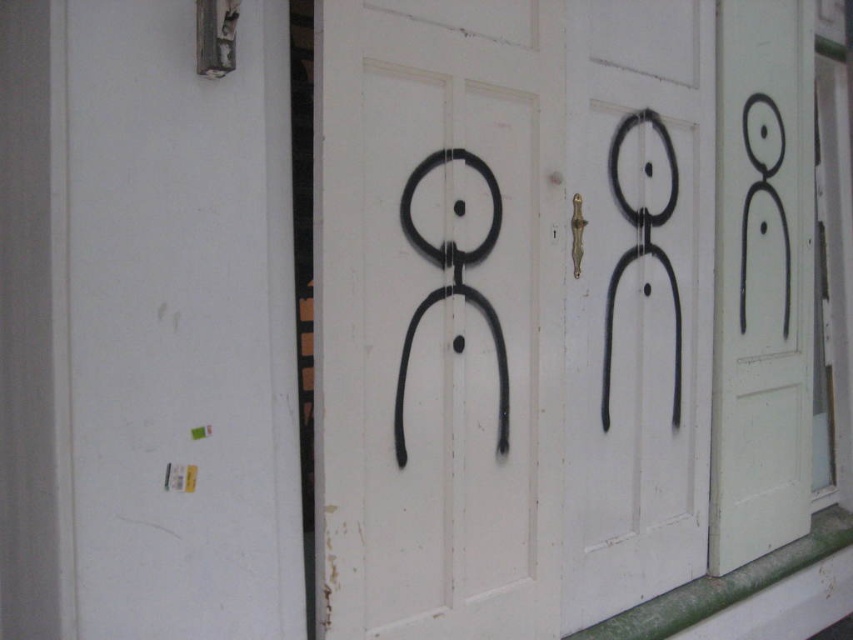
You are a delivery person approaching the building and need to enter through the doors. The doors are labeled as the black matte door at center and the black matte door at right. Which door should you open first to enter?

The black matte door at center should be opened first because it is positioned under the black matte door at right, indicating it is the lower door in the pair and typically the one opened first.

You are a painter who wants to cover the black matte figure at center and the black matte door at right with white paint. Which object requires more paint to cover completely?

The black matte figure at center requires more paint to cover completely because it is larger in size than the black matte door at right.

You are standing in front of the building and want to enter through the doors. Based on the image, where exactly are the black matte door at center located in terms of coordinates?

The black matte door at center is located at coordinates point (x=509, y=310).